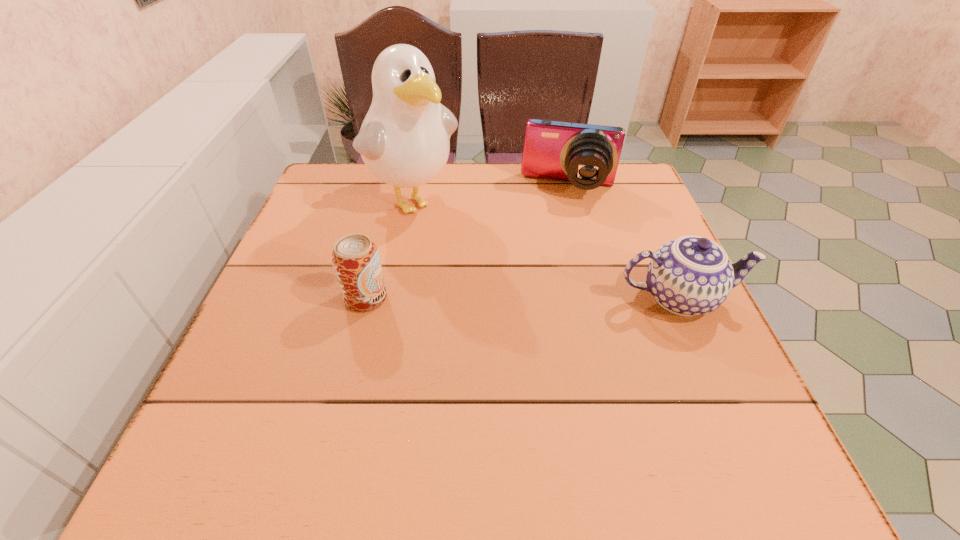
The width and height of the screenshot is (960, 540). I want to click on vacant region that satisfies the following two spatial constraints: 1. on the front side of the chinaware; 2. at the spout of the camera, so click(597, 298).